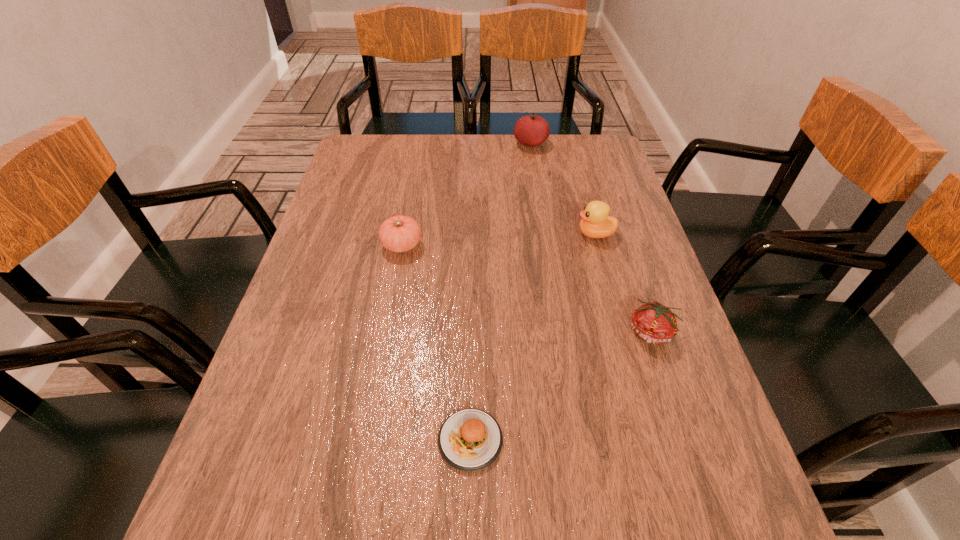
Locate an element on the screen. vacant space that is in between the food and the duckling is located at coordinates (533, 337).

Identify the location of unoccupied area between the third object from left to right and the second object from left to right. (500, 292).

The width and height of the screenshot is (960, 540). I want to click on vacant space that's between the food and the tallest tomato, so click(x=500, y=292).

The width and height of the screenshot is (960, 540). Identify the location of free space between the second nearest tomato and the duckling. (498, 240).

The width and height of the screenshot is (960, 540). I want to click on object identified as the fourth closest to the second nearest object, so click(532, 130).

Identify which object is the fourth nearest to the duckling. Please provide its 2D coordinates. Your answer should be formatted as a tuple, i.e. [(x, y)], where the tuple contains the x and y coordinates of a point satisfying the conditions above.

[(469, 440)]

Select which tomato is the second closest to the food. Please provide its 2D coordinates. Your answer should be formatted as a tuple, i.e. [(x, y)], where the tuple contains the x and y coordinates of a point satisfying the conditions above.

[(400, 233)]

I want to click on the second closest tomato to the duckling, so click(x=532, y=130).

Locate an element on the screen. Image resolution: width=960 pixels, height=540 pixels. free space that satisfies the following two spatial constraints: 1. on the back side of the tallest tomato; 2. on the right side of the shortest object is located at coordinates (475, 144).

The height and width of the screenshot is (540, 960). What are the coordinates of `free spot that satisfies the following two spatial constraints: 1. on the front side of the tallest tomato; 2. on the right side of the rightmost tomato` in the screenshot? It's located at (561, 333).